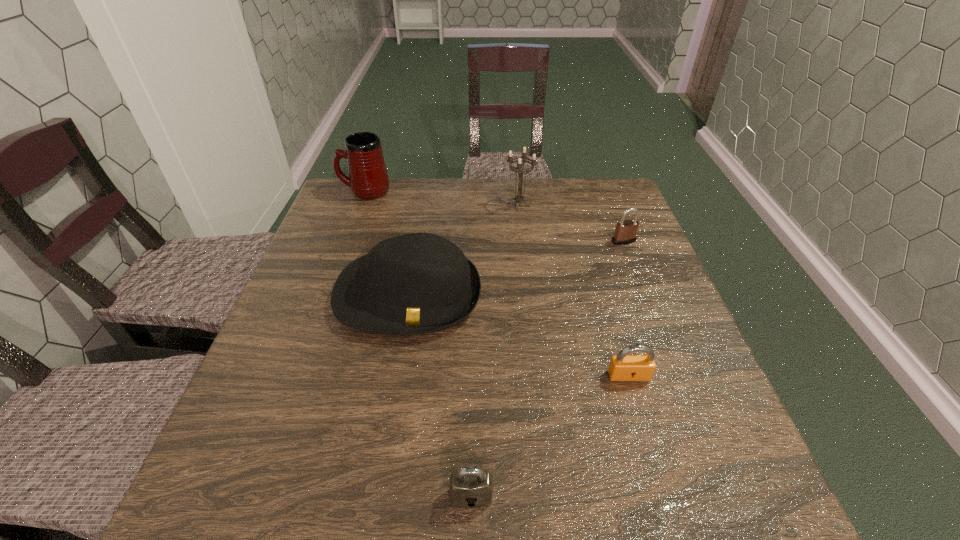
I want to click on vacant area at the far edge, so 447,194.

You are a GUI agent. You are given a task and a screenshot of the screen. Output one action in this format:
    pyautogui.click(x=<x>, y=<y>)
    Task: Click on the vacant space at the left edge
    
    Given the screenshot: What is the action you would take?
    pyautogui.click(x=245, y=445)

What are the coordinates of `vacant region at the right edge of the desktop` in the screenshot? It's located at (654, 278).

Identify the location of vacant space in between the candle holder and the third farthest object. (571, 223).

Identify the location of free spot between the fourth shortest object and the third object from right to left. The height and width of the screenshot is (540, 960). [x=464, y=250].

This screenshot has height=540, width=960. In order to click on free space between the mug and the candle holder in this screenshot , I will do `click(442, 198)`.

Locate an element on the screen. The width and height of the screenshot is (960, 540). vacant space that's between the rightmost padlock and the mug is located at coordinates (494, 216).

Find the location of `empty space between the nearest object and the third farthest object`. empty space between the nearest object and the third farthest object is located at coordinates (547, 368).

Identify the location of vacant space that's between the second nearest padlock and the nearest padlock. (550, 436).

What are the coordinates of `blank region between the mug and the rightmost object` in the screenshot? It's located at (494, 216).